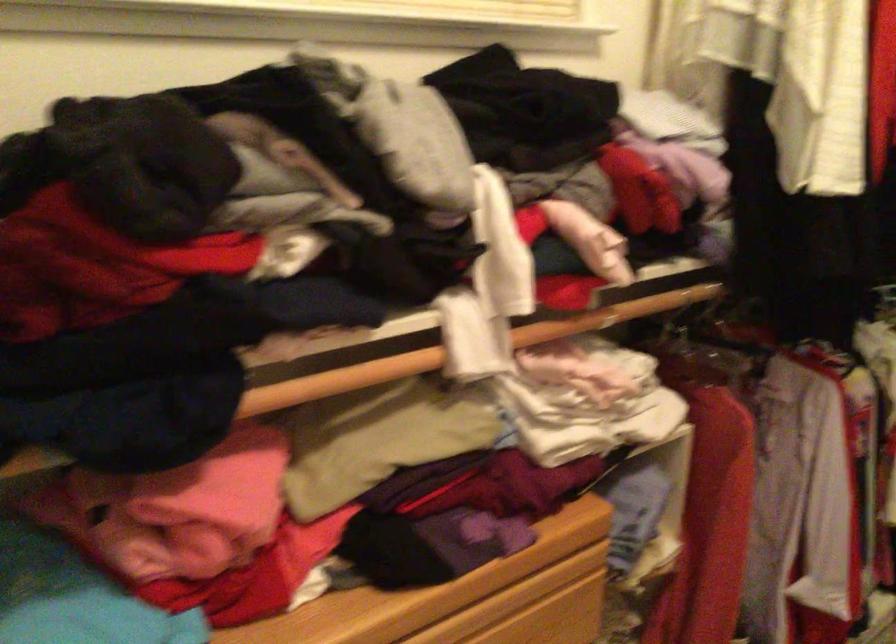
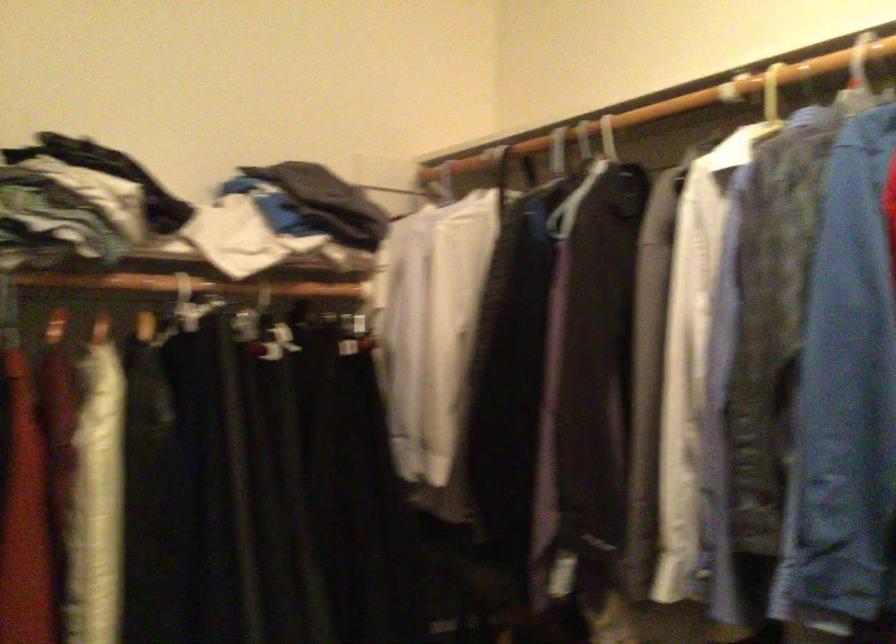
Question: The first image is from the beginning of the video and the second image is from the end. How did the camera likely rotate when shooting the video?

Choices:
 (A) Left
 (B) Right
 (C) Up
 (D) Down

Answer: (B)